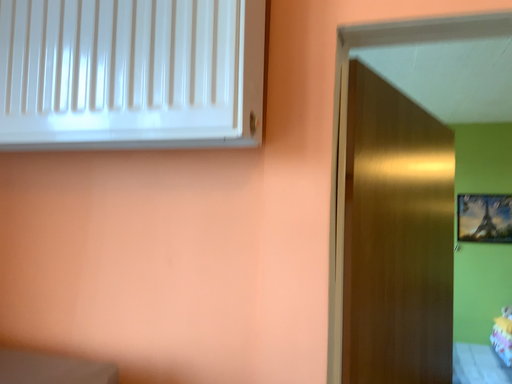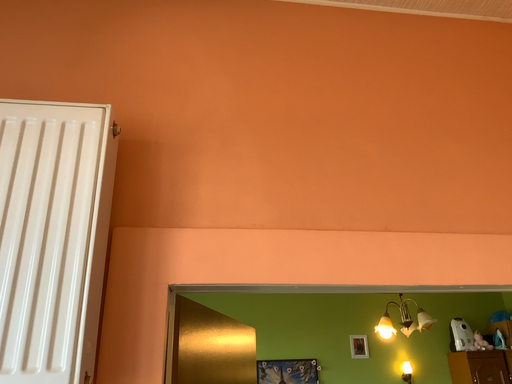
Question: How did the camera likely rotate when shooting the video?

Choices:
 (A) rotated right
 (B) rotated left

Answer: (A)